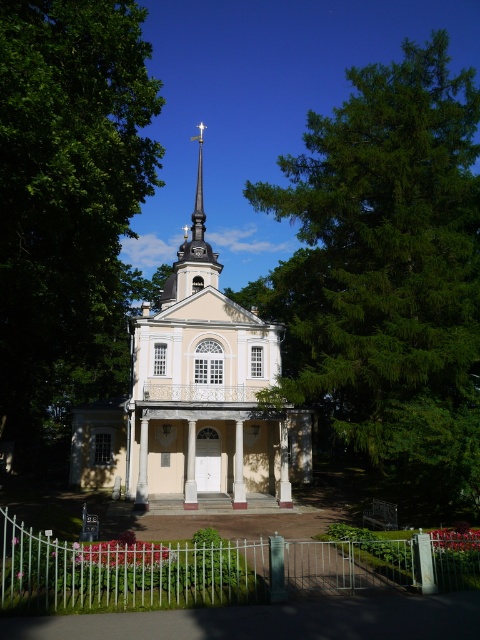
You are standing in front of the church and want to take a photo that includes both the church and the green leafy tree at center. Where should you position yourself relative to the tree to ensure both are in the frame?

To include both the church and the green leafy tree at center in your photo, position yourself to the right or left of the tree since the tree is centrally located at point (69,200). This placement ensures the church and tree are within the frame.